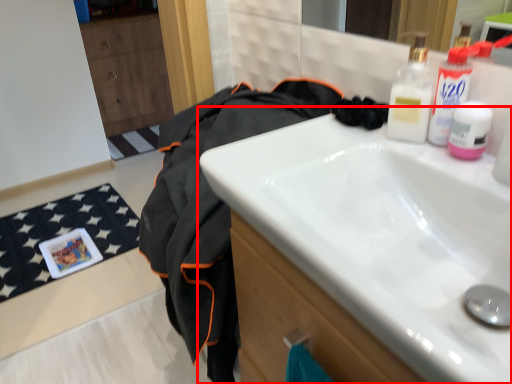
Question: In this image, where is sink (annotated by the red box) located relative to clothing?

Choices:
 (A) left
 (B) right

Answer: (B)